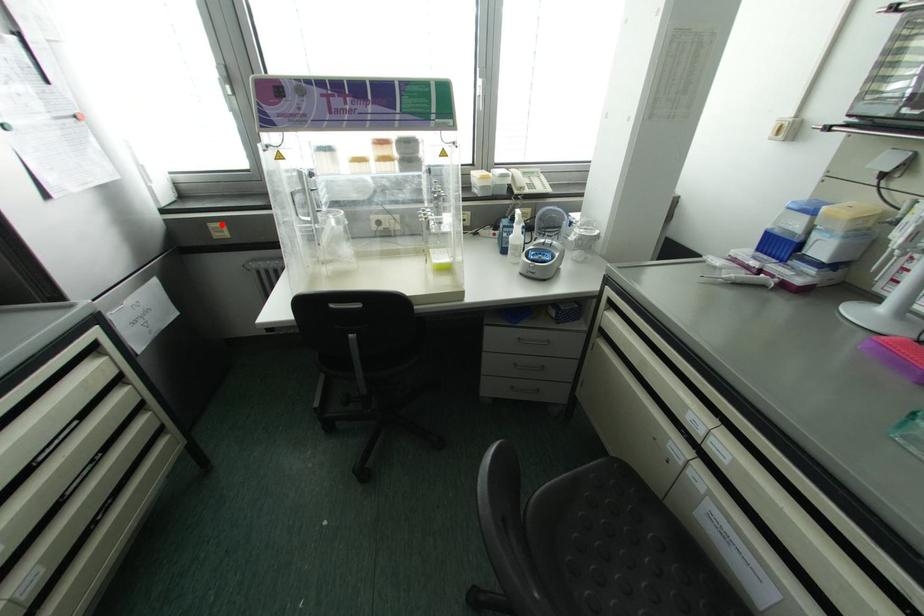
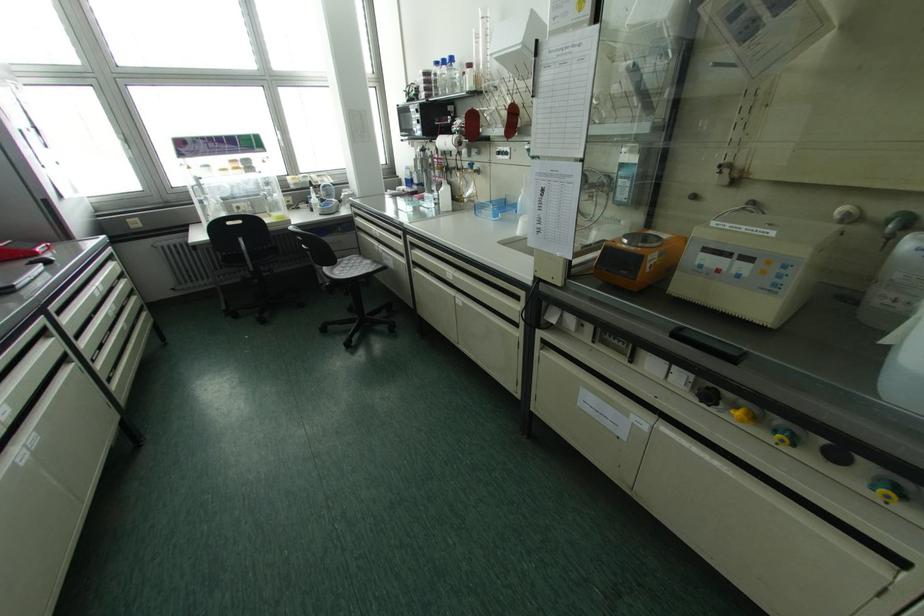
Question: I am providing you with two images of the same scene from different viewpoints. In image1, a red point is highlighted. Considering the same 3D point in image2, which of the following is correct?

Choices:
 (A) It is closer
 (B) It is farther

Answer: (B)